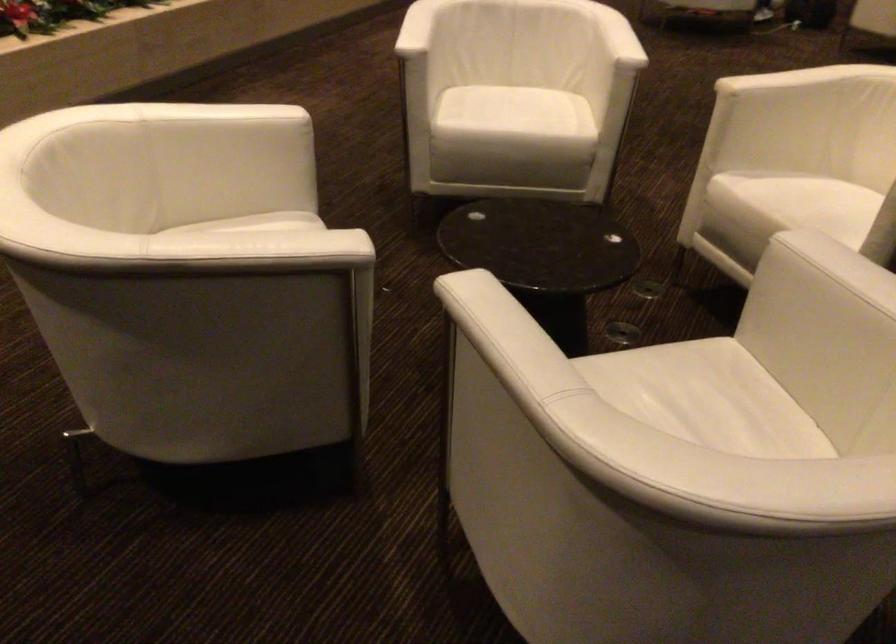
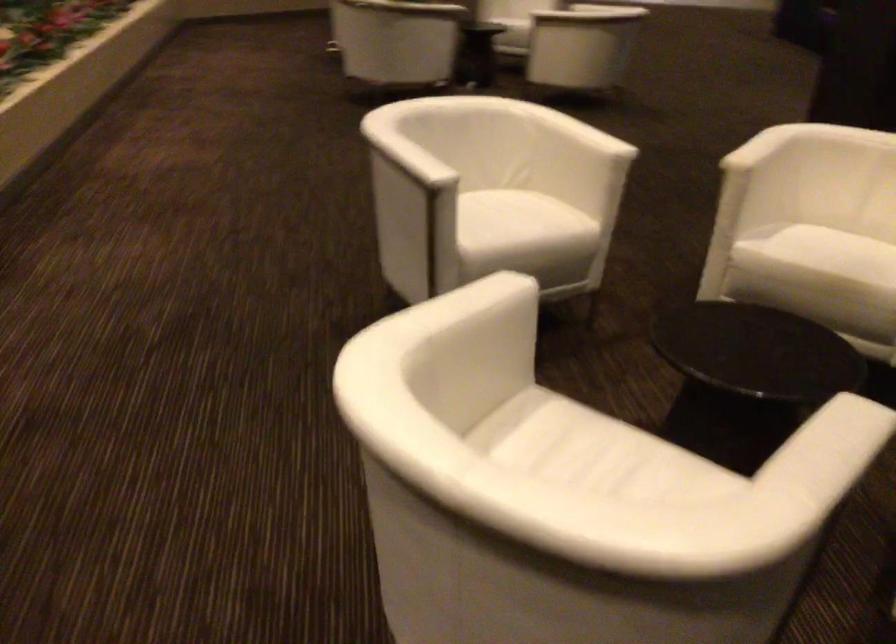
The point at (252, 243) is marked in the first image. Where is the corresponding point in the second image?

(839, 446)